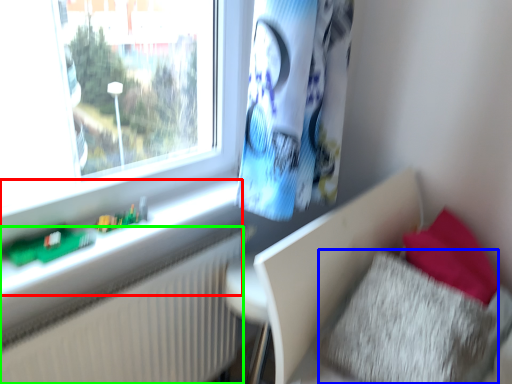
Question: Considering the real-world distances, which object is farthest from window sill (highlighted by a red box)? pillow (highlighted by a blue box) or radiator (highlighted by a green box)?

Choices:
 (A) pillow
 (B) radiator

Answer: (A)